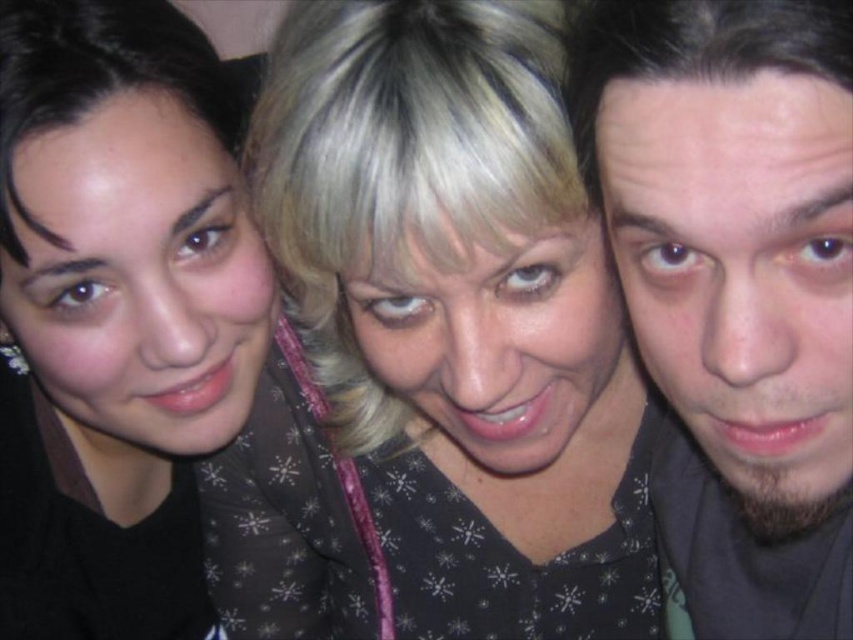
Does point (15, 221) come farther from viewer compared to point (474, 268)?

Yes, point (15, 221) is farther from viewer.

Does point (175, 218) come in front of point (592, 282)?

That is False.

Locate an element on the screen. The image size is (853, 640). matte black face at left is located at coordinates (138, 276).

Is point (370, 593) in front of point (155, 134)?

No.

Is black matte shirt at center to the left of matte black face at left from the viewer's perspective?

In fact, black matte shirt at center is to the right of matte black face at left.

Which is in front, point (456, 584) or point (41, 134)?

Positioned in front is point (41, 134).

Find the location of a particular element. Image resolution: width=853 pixels, height=640 pixels. black matte shirt at center is located at coordinates (432, 346).

Between black matte shirt at center and beige matte skin at right, which one has more height?

With more height is black matte shirt at center.

Can you confirm if black matte shirt at center is thinner than beige matte skin at right?

No.

Image resolution: width=853 pixels, height=640 pixels. I want to click on black matte shirt at center, so click(432, 346).